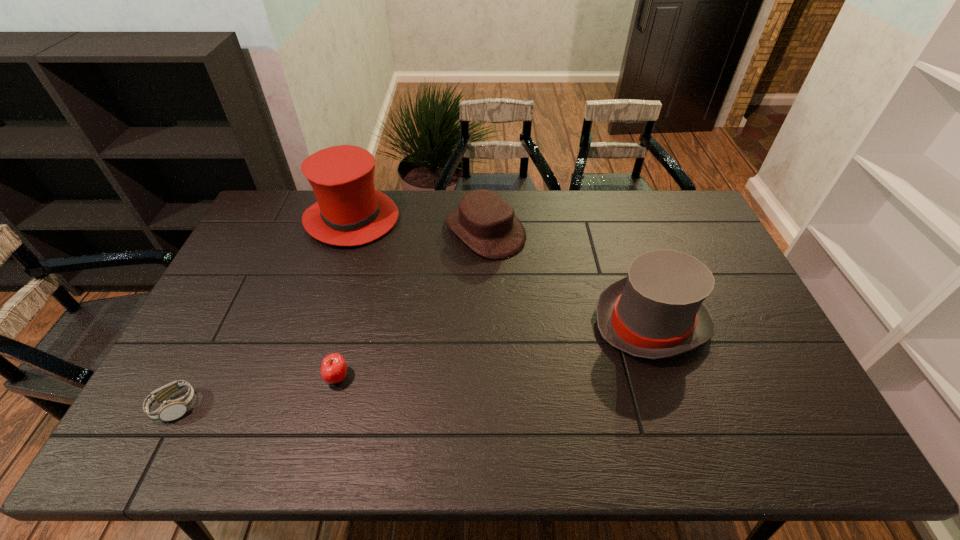
The image size is (960, 540). Identify the location of vacant space located 0.080m on the left of the rightmost hat. click(566, 322).

The width and height of the screenshot is (960, 540). I want to click on vacant space situated 0.380m on the right of the shortest hat, so click(x=633, y=231).

This screenshot has width=960, height=540. In order to click on vacant space located on the left of the apple in this screenshot , I will do `click(179, 377)`.

This screenshot has width=960, height=540. I want to click on free region located on the face of the shortest object, so pyautogui.click(x=328, y=407).

What are the coordinates of `object at the near edge` in the screenshot? It's located at (170, 410).

Locate an element on the screen. The width and height of the screenshot is (960, 540). object that is at the left edge is located at coordinates (170, 410).

Locate an element on the screen. Image resolution: width=960 pixels, height=540 pixels. object that is at the right edge is located at coordinates (657, 311).

In order to click on object at the near left corner in this screenshot , I will do `click(170, 410)`.

In the image, there is a desktop. Identify the location of vacant area at the far edge. The width and height of the screenshot is (960, 540). (516, 190).

You are a GUI agent. You are given a task and a screenshot of the screen. Output one action in this format:
    pyautogui.click(x=<x>, y=<y>)
    Task: Click on the vacant space at the near edge
    The image size is (960, 540).
    Given the screenshot: What is the action you would take?
    pyautogui.click(x=272, y=444)